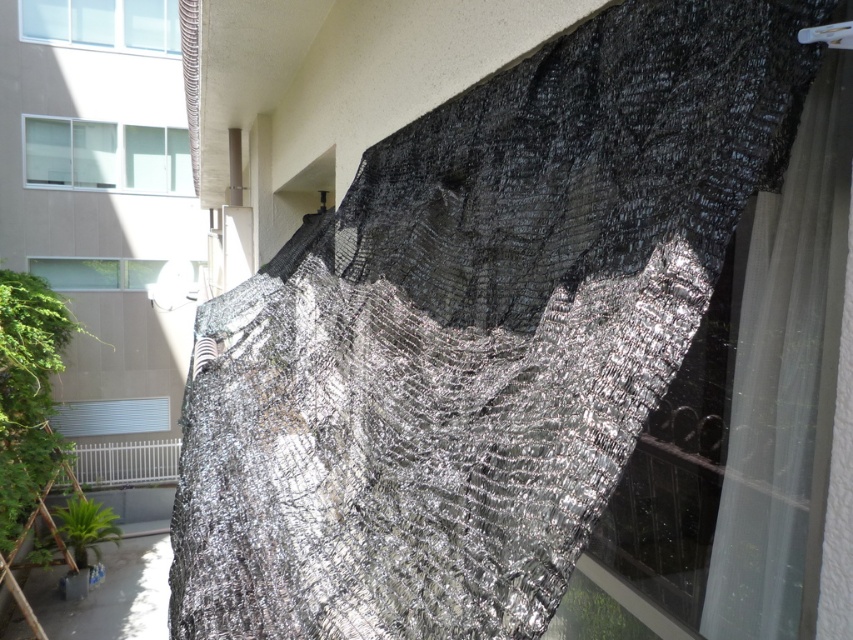
In the scene shown: You are standing in front of the building and notice a point marked at coordinates (785, 381). Based on the scene description, what object is located at that point?

→ The point at coordinates (785, 381) corresponds to the white sheer curtain at upper right.

You are an interior designer planning to install a new window covering. You have a white sheer curtain at upper right and a matte gray window at upper left in view. Which object has a smaller width?

The white sheer curtain at upper right has a lesser width compared to the matte gray window at upper left.